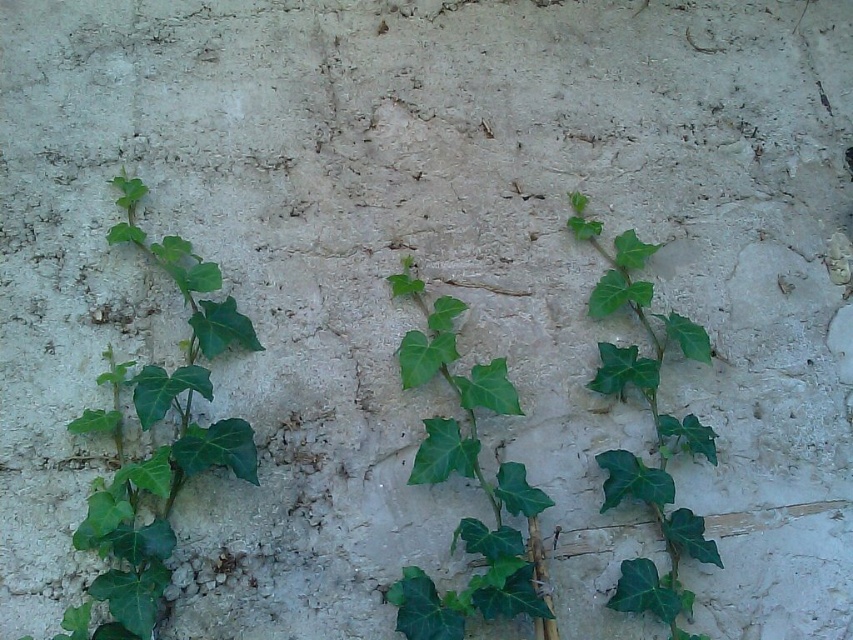
Does green leafy vine at left have a lesser height compared to green leafy vine at right?

Correct, green leafy vine at left is not as tall as green leafy vine at right.

Is green leafy vine at left closer to the viewer compared to green leafy vine at right?

Yes.

Who is more forward, (142, 376) or (630, 237)?

Point (142, 376)

Identify the location of green leafy vine at left. (160, 444).

Between green leafy vine at left and green leafy vine at center, which one appears on the left side from the viewer's perspective?

green leafy vine at left is more to the left.

Image resolution: width=853 pixels, height=640 pixels. What are the coordinates of `green leafy vine at left` in the screenshot? It's located at (160, 444).

How much distance is there between green leafy vine at center and green leafy vine at right?

green leafy vine at center and green leafy vine at right are 7.27 inches apart.

Does green leafy vine at center appear on the left side of green leafy vine at right?

Yes, green leafy vine at center is to the left of green leafy vine at right.

Does point (512, 548) come farther from viewer compared to point (619, 244)?

No, (512, 548) is in front of (619, 244).

Identify the location of green leafy vine at center. (469, 477).